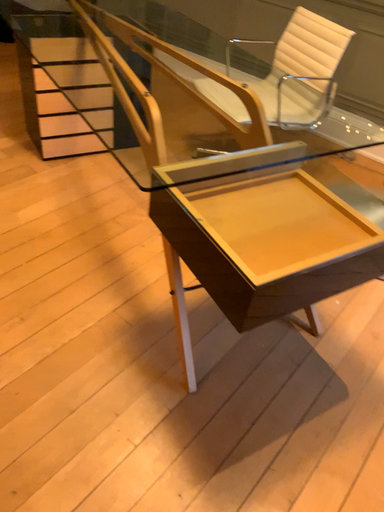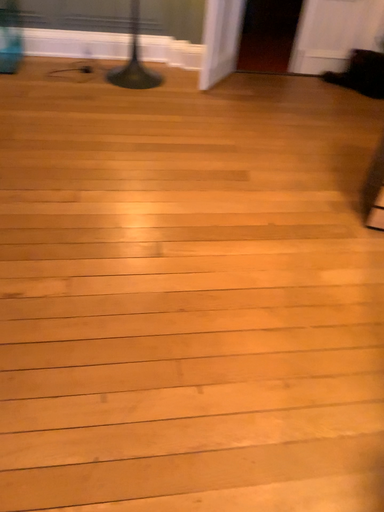
Question: How did the camera likely rotate when shooting the video?

Choices:
 (A) rotated upward
 (B) rotated downward

Answer: (A)